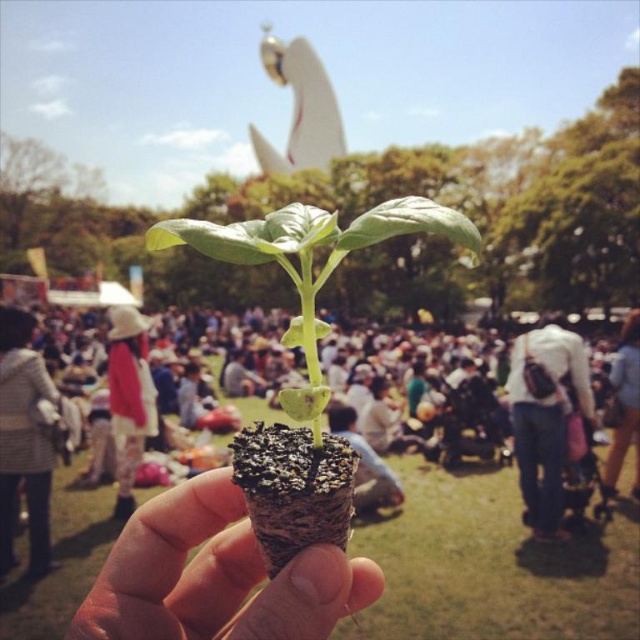
Is brown textured cone at center closer to the viewer compared to light brown fabric pants at center?

Yes, it is.

At what (x,y) coordinates should I click in order to perform the action: click on brown textured cone at center. Please return your answer as a coordinate pair (x, y). Looking at the image, I should click on (216, 576).

Is point (20, 458) positioned after point (636, 339)?

No, it is in front of (636, 339).

I want to click on striped sweater at lower left, so click(x=22, y=442).

Can you confirm if striped sweater at lower left is taller than light brown fabric pants at center?

Yes.

Which is behind, point (36, 360) or point (333, 422)?

Point (333, 422)

Is point (40, 497) farther from camera compared to point (364, 512)?

Yes, it is behind point (364, 512).

You are a GUI agent. You are given a task and a screenshot of the screen. Output one action in this format:
    pyautogui.click(x=<x>, y=<y>)
    Task: Click on the striped sweater at lower left
    
    Given the screenshot: What is the action you would take?
    pyautogui.click(x=22, y=442)